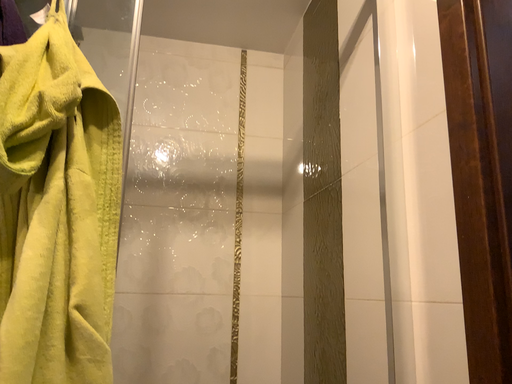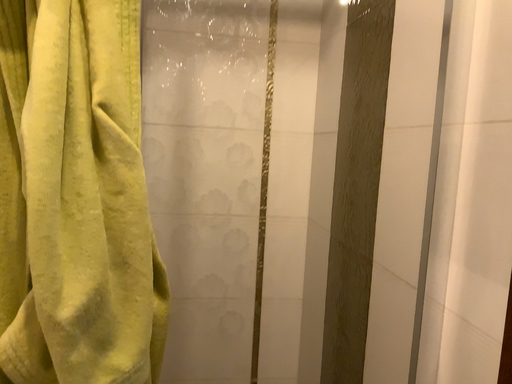
Question: How did the camera likely rotate when shooting the video?

Choices:
 (A) rotated upward
 (B) rotated downward

Answer: (B)